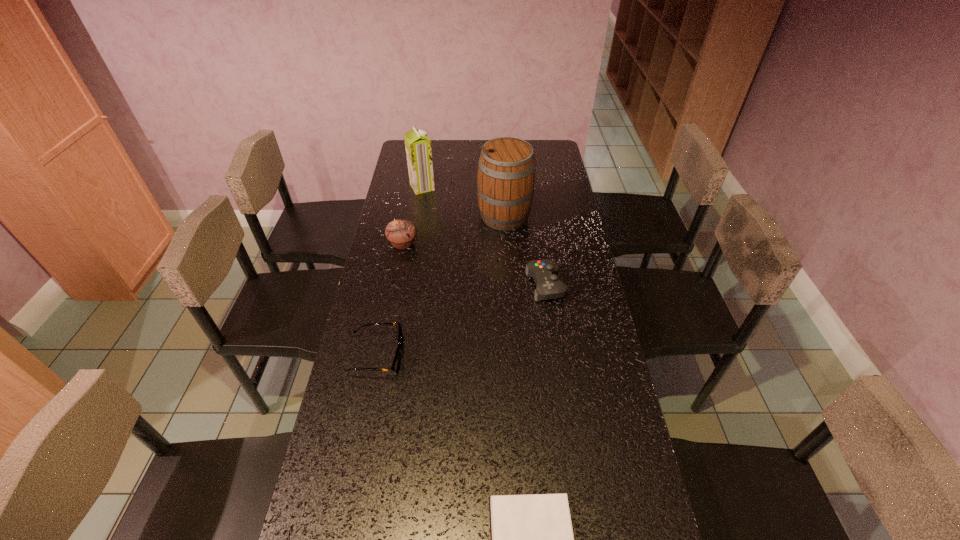
Find the location of a particular element. Image resolution: width=960 pixels, height=540 pixels. vacant space situated on the back of the fourth farthest object is located at coordinates (535, 209).

Image resolution: width=960 pixels, height=540 pixels. Find the location of `vacant space situated 0.270m on the front-facing side of the second shortest object`. vacant space situated 0.270m on the front-facing side of the second shortest object is located at coordinates (495, 356).

In order to click on soya milk present at the left edge in this screenshot , I will do `click(417, 144)`.

This screenshot has height=540, width=960. Find the location of `muffin situated at the left edge`. muffin situated at the left edge is located at coordinates (401, 233).

Where is `sunglasses situated at the left edge`? The image size is (960, 540). sunglasses situated at the left edge is located at coordinates (395, 367).

Identify the location of object located in the right edge section of the desktop. (544, 272).

I want to click on vacant space at the far edge, so click(x=482, y=147).

I want to click on vacant space at the left edge, so click(x=408, y=183).

Where is `free space at the right edge of the desktop`? Image resolution: width=960 pixels, height=540 pixels. free space at the right edge of the desktop is located at coordinates (588, 290).

Locate an element on the screen. The height and width of the screenshot is (540, 960). empty space between the fourth nearest object and the fifth farthest object is located at coordinates (390, 300).